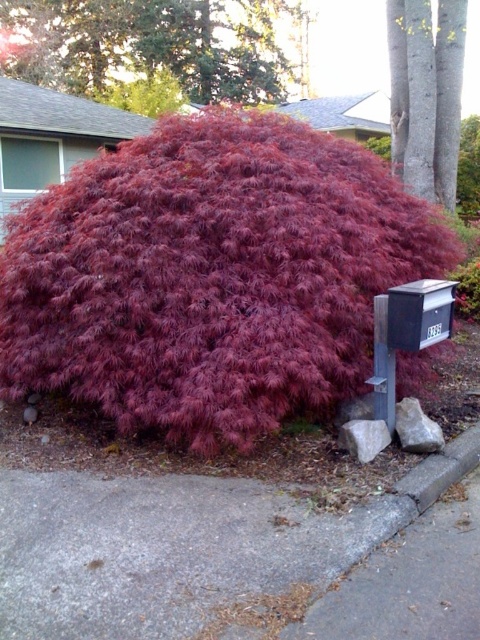
Question: Among these points, which one is nearest to the camera?

Choices:
 (A) (26, 74)
 (B) (444, 48)
 (C) (316, 333)

Answer: (C)

Question: Which object is positioned closest to the shiny red leaves at upper center?

Choices:
 (A) black matte mailbox at right
 (B) purple matte maple at center
 (C) smooth gray bark at upper right

Answer: (C)

Question: Is purple matte maple at center above black matte mailbox at right?

Choices:
 (A) yes
 (B) no

Answer: (A)

Question: Where is purple matte maple at center located in relation to shiny red leaves at upper center in the image?

Choices:
 (A) right
 (B) left

Answer: (A)

Question: Estimate the real-world distances between objects in this image. Which object is farther from the shiny red leaves at upper center?

Choices:
 (A) black matte mailbox at right
 (B) smooth gray bark at upper right

Answer: (A)

Question: In this image, where is purple matte maple at center located relative to black matte mailbox at right?

Choices:
 (A) below
 (B) above

Answer: (B)